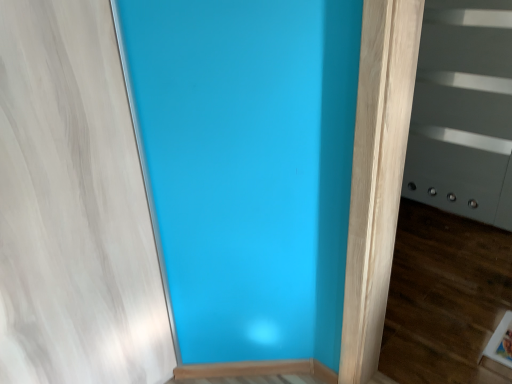
Looking at this image, measure the distance between point (420, 104) and camera.

A distance of 2.40 meters exists between point (420, 104) and camera.

Image resolution: width=512 pixels, height=384 pixels. What do you see at coordinates (463, 111) in the screenshot? I see `satin gray screen door at right` at bounding box center [463, 111].

At what (x,y) coordinates should I click in order to perform the action: click on satin gray screen door at right. Please return your answer as a coordinate pair (x, y). The width and height of the screenshot is (512, 384). Looking at the image, I should click on (463, 111).

Identify the location of satin gray screen door at right. (463, 111).